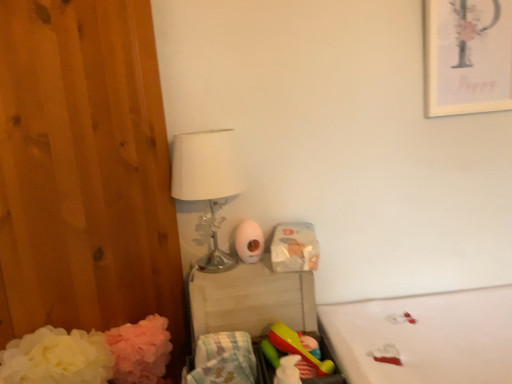
Identify the location of unoccupied area in front of white glossy toilet paper at center. This screenshot has width=512, height=384. (249, 274).